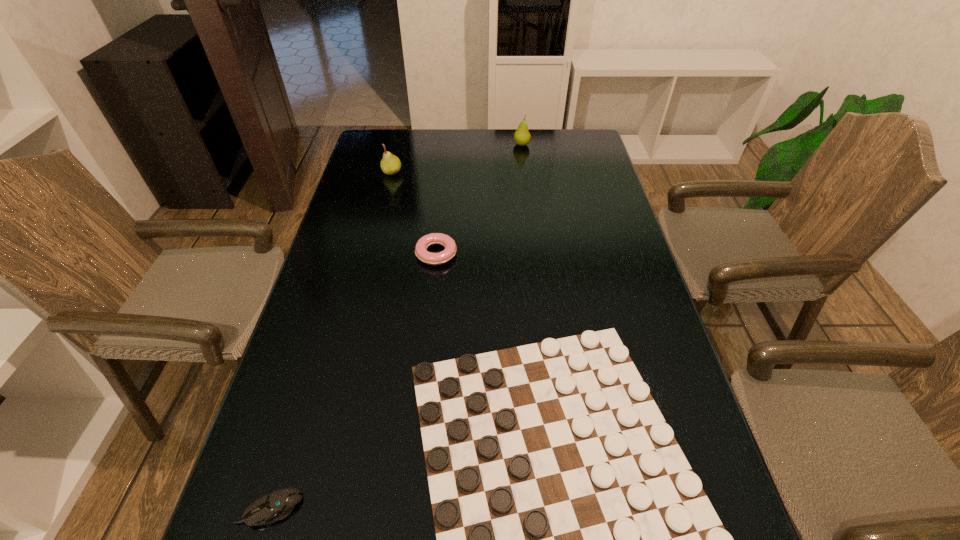
Find the location of a particular element. The height and width of the screenshot is (540, 960). the right pear is located at coordinates (522, 137).

You are a GUI agent. You are given a task and a screenshot of the screen. Output one action in this format:
    pyautogui.click(x=<x>, y=<y>)
    Task: Click on the farthest object
    The height and width of the screenshot is (540, 960).
    Given the screenshot: What is the action you would take?
    pyautogui.click(x=522, y=137)

Find the location of a particular element. This screenshot has height=540, width=960. the left pear is located at coordinates (390, 164).

The width and height of the screenshot is (960, 540). I want to click on the second farthest object, so click(x=390, y=164).

Identify the location of doughnut. The image size is (960, 540). (448, 253).

Identify the location of computer mouse. The width and height of the screenshot is (960, 540). (274, 506).

Find the location of a particular element. This screenshot has height=540, width=960. vacant region located on the back of the right pear is located at coordinates (520, 130).

Where is `vacant space located on the right of the nearer pear`? The image size is (960, 540). vacant space located on the right of the nearer pear is located at coordinates (492, 172).

What are the coordinates of `free location located 0.110m on the back of the third farthest object` in the screenshot? It's located at (440, 216).

You are a GUI agent. You are given a task and a screenshot of the screen. Output one action in this format:
    pyautogui.click(x=<x>, y=<y>)
    Task: Click on the vacant space located 0.220m on the right of the computer mouse
    This screenshot has height=540, width=960.
    Given the screenshot: What is the action you would take?
    pyautogui.click(x=425, y=509)